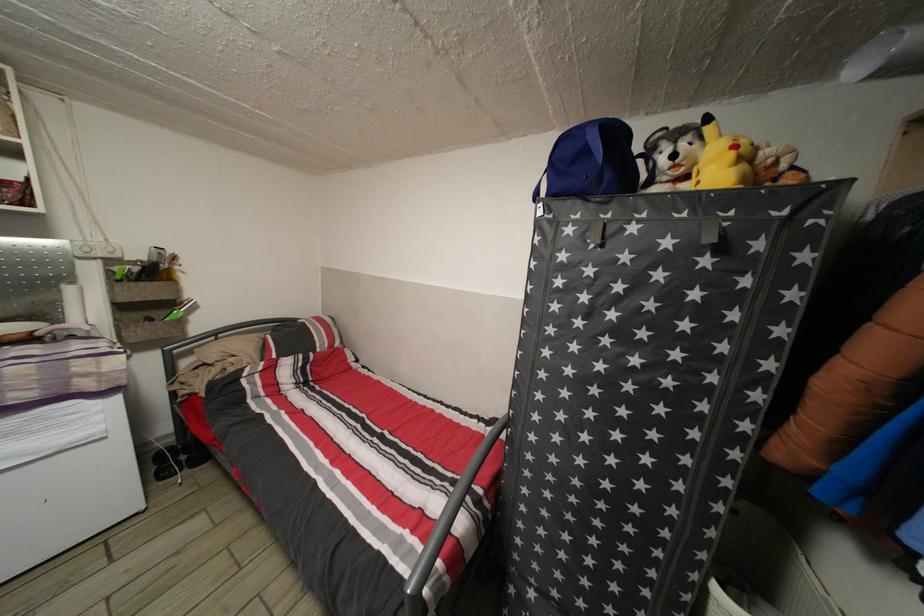
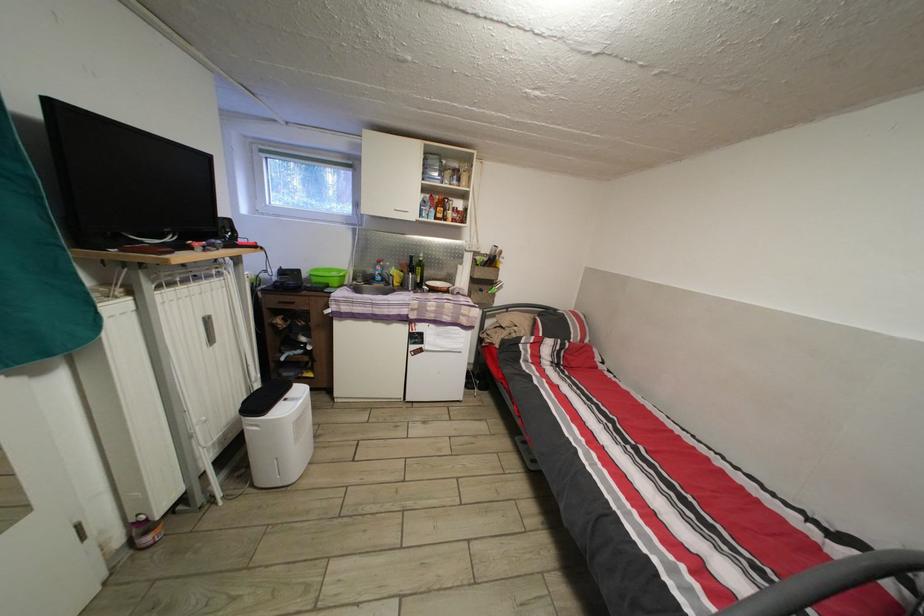
Question: The camera is either moving clockwise (left) or counter-clockwise (right) around the object. The first image is from the beginning of the video and the second image is from the end. Is the camera moving left or right when shooting the video?

Choices:
 (A) Left
 (B) Right

Answer: (B)